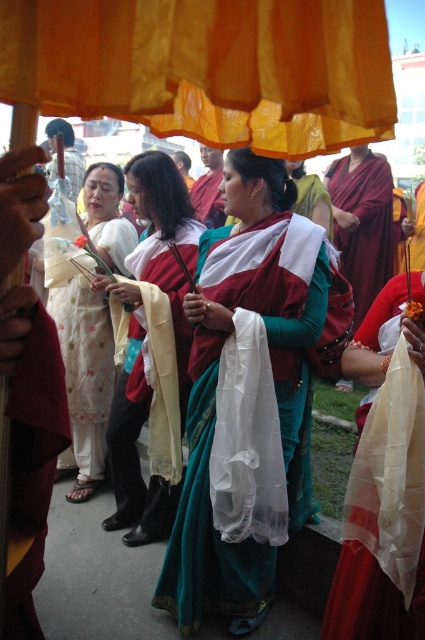
Is matte white scarf at center behind white sheer cloth at center?

Yes.

Is point (113, 416) closer to viewer compared to point (229, 534)?

No, (113, 416) is behind (229, 534).

The height and width of the screenshot is (640, 425). What are the coordinates of `matte white scarf at center` in the screenshot? It's located at (135, 440).

Is white embroidered dress at center to the right of maroon silk robe at center from the viewer's perspective?

No, white embroidered dress at center is not to the right of maroon silk robe at center.

Is white embroidered dress at center wider than maroon silk robe at center?

Incorrect, white embroidered dress at center's width does not surpass maroon silk robe at center's.

Is point (93, 204) less distant than point (385, 269)?

Yes, it is in front of point (385, 269).

At what (x,y) coordinates should I click in order to perform the action: click on white embroidered dress at center. Please return your answer as a coordinate pair (x, y). This screenshot has height=640, width=425. Looking at the image, I should click on (85, 380).

Consider the image. Is matte white scarf at center taller than maroon silk robe at center?

Yes.

Image resolution: width=425 pixels, height=640 pixels. What do you see at coordinates (135, 440) in the screenshot?
I see `matte white scarf at center` at bounding box center [135, 440].

Which is in front, point (167, 536) or point (368, 260)?

Point (167, 536)

The image size is (425, 640). What are the coordinates of `matte white scarf at center` in the screenshot? It's located at (135, 440).